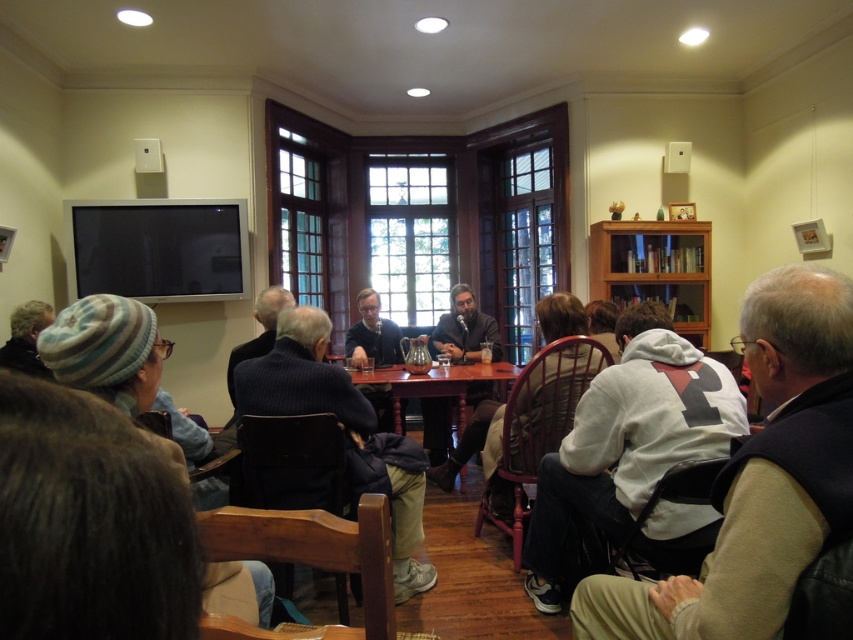
Question: Can you confirm if white fleece jacket at lower right is bigger than dark blue sweater at center?

Choices:
 (A) yes
 (B) no

Answer: (A)

Question: Considering the real-world distances, which object is closest to the striped wool hat at lower left?

Choices:
 (A) dark blue sweater at center
 (B) dark brown knit hat at lower left
 (C) white fleece jacket at lower right
 (D) white cotton hoodie at lower right

Answer: (A)

Question: Which point is closer to the camera?

Choices:
 (A) striped wool hat at lower left
 (B) dark gray sweater at center
 (C) wooden table at center

Answer: (A)

Question: Does white cotton hoodie at lower right have a smaller size compared to dark blue sweater at center?

Choices:
 (A) yes
 (B) no

Answer: (A)

Question: Can you confirm if white fleece jacket at lower right is smaller than dark gray sweater at center?

Choices:
 (A) no
 (B) yes

Answer: (A)

Question: Among these points, which one is farthest from the camera?

Choices:
 (A) (1, 346)
 (B) (819, 532)
 (C) (355, 413)

Answer: (A)